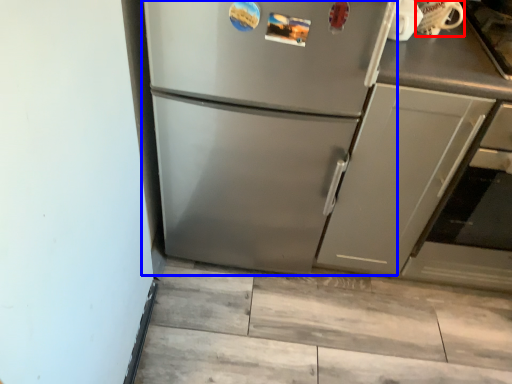
Question: Which of the following is the closest to the observer, appliance (highlighted by a red box) or refrigerator (highlighted by a blue box)?

Choices:
 (A) appliance
 (B) refrigerator

Answer: (B)